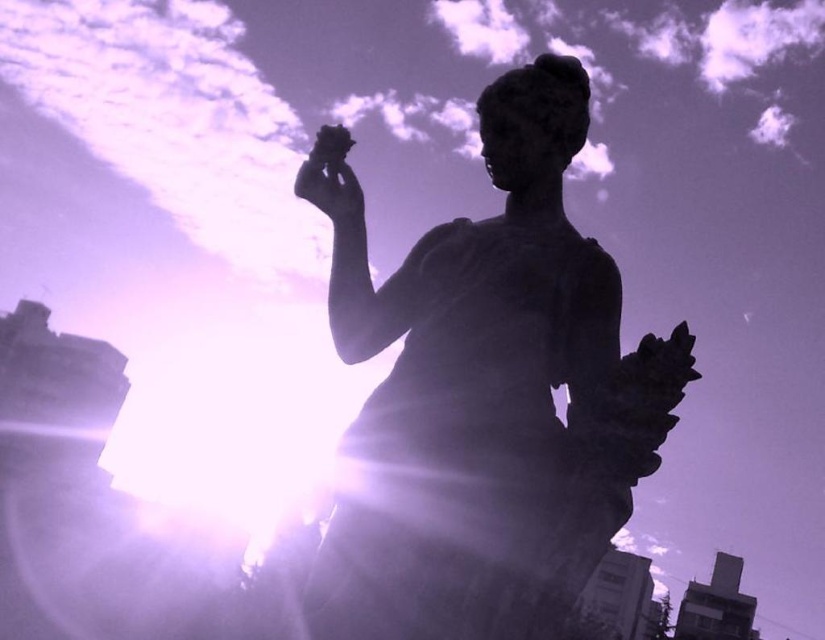
Does sculpted stone statue at center appear on the left side of matte black hand at upper center?

Incorrect, sculpted stone statue at center is not on the left side of matte black hand at upper center.

Which is in front, point (366, 486) or point (333, 148)?

Point (366, 486)

This screenshot has height=640, width=825. In order to click on sculpted stone statue at center in this screenshot , I will do `click(489, 401)`.